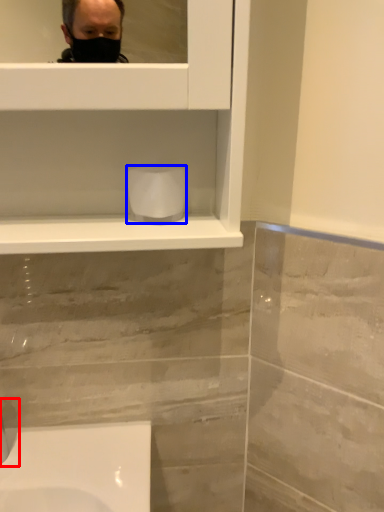
Question: Among these objects, which one is farthest to the camera, faucet (highlighted by a red box) or toilet paper (highlighted by a blue box)?

Choices:
 (A) faucet
 (B) toilet paper

Answer: (B)